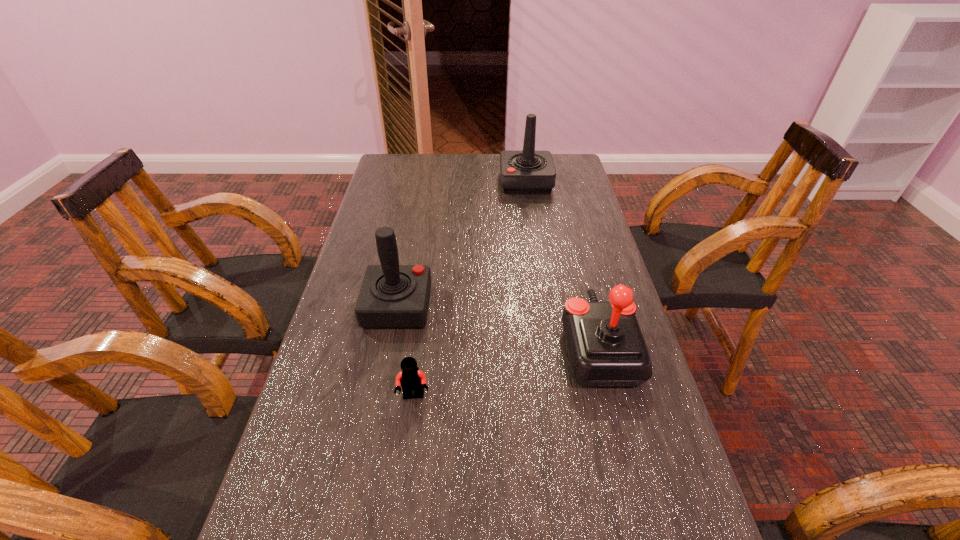
Identify the location of blank space that satisfies the following two spatial constraints: 1. on the front-facing side of the farthest joystick; 2. on the front-facing side of the Lego. The image size is (960, 540). (558, 396).